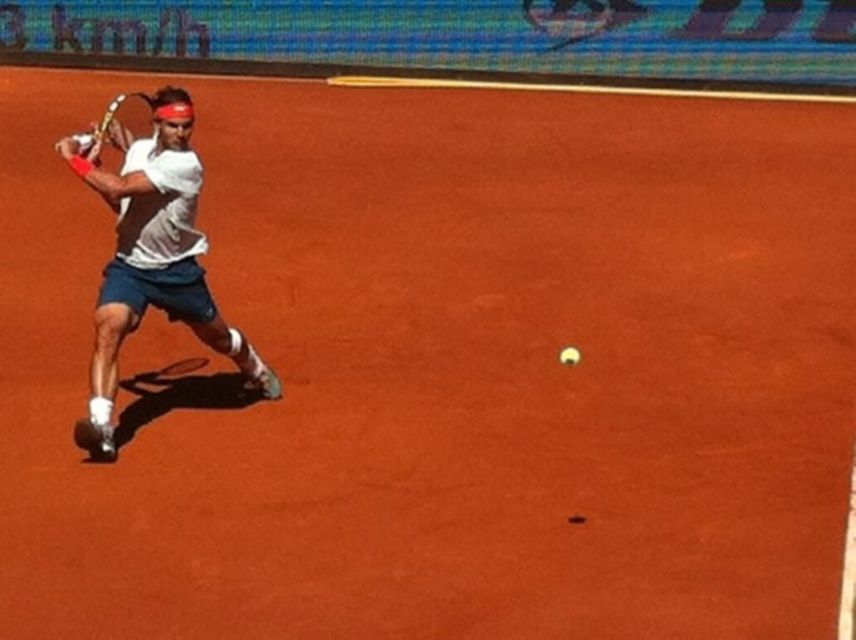
Question: Is white cotton shirt at left positioned behind yellow matte tennis ball at center?

Choices:
 (A) yes
 (B) no

Answer: (B)

Question: Among these points, which one is nearest to the camera?

Choices:
 (A) (81, 134)
 (B) (575, 348)
 (C) (174, 166)

Answer: (C)

Question: Where is metallic gold tennis racket at left located in relation to yellow matte tennis ball at center in the image?

Choices:
 (A) right
 (B) left

Answer: (B)

Question: Can you confirm if metallic gold tennis racket at left is smaller than yellow matte tennis ball at center?

Choices:
 (A) yes
 (B) no

Answer: (B)

Question: Estimate the real-world distances between objects in this image. Which object is farther from the white cotton shirt at left?

Choices:
 (A) metallic gold tennis racket at left
 (B) yellow matte tennis ball at center

Answer: (B)

Question: Considering the real-world distances, which object is farthest from the yellow matte tennis ball at center?

Choices:
 (A) metallic gold tennis racket at left
 (B) white cotton shirt at left

Answer: (A)